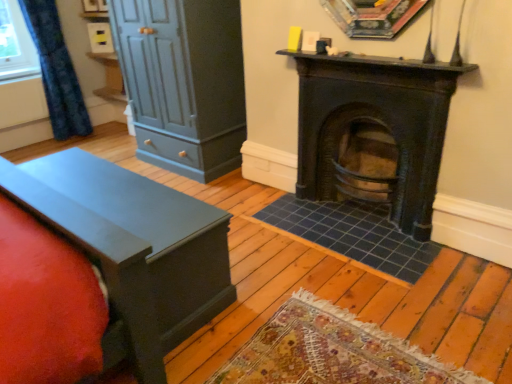
Question: Is matte dark gray dresser at left at the back of dark brown wood burning stove at center?

Choices:
 (A) yes
 (B) no

Answer: (B)

Question: Considering the relative sizes of dark brown wood burning stove at center and matte dark gray dresser at left in the image provided, is dark brown wood burning stove at center bigger than matte dark gray dresser at left?

Choices:
 (A) yes
 (B) no

Answer: (B)

Question: From the image's perspective, is dark brown wood burning stove at center above matte dark gray dresser at left?

Choices:
 (A) no
 (B) yes

Answer: (A)

Question: Is matte dark gray dresser at left a part of dark brown wood burning stove at center?

Choices:
 (A) yes
 (B) no

Answer: (B)

Question: Is the depth of dark brown wood burning stove at center greater than that of matte dark gray dresser at left?

Choices:
 (A) yes
 (B) no

Answer: (B)

Question: Based on their positions, is matte dark gray dresser at left located to the left or right of dark brown wood burning stove at center?

Choices:
 (A) right
 (B) left

Answer: (B)

Question: From the image's perspective, is matte dark gray dresser at left positioned above or below dark brown wood burning stove at center?

Choices:
 (A) above
 (B) below

Answer: (A)

Question: Does point (233, 44) appear closer or farther from the camera than point (404, 150)?

Choices:
 (A) closer
 (B) farther

Answer: (B)

Question: From a real-world perspective, relative to dark brown wood burning stove at center, is matte dark gray dresser at left vertically above or below?

Choices:
 (A) below
 (B) above

Answer: (B)

Question: Looking at their shapes, would you say matte black chest at left is wider or thinner than blue textured curtain at left?

Choices:
 (A) thin
 (B) wide

Answer: (B)

Question: Visually, is matte black chest at left positioned to the left or to the right of blue textured curtain at left?

Choices:
 (A) right
 (B) left

Answer: (A)

Question: Is matte black chest at left bigger or smaller than blue textured curtain at left?

Choices:
 (A) small
 (B) big

Answer: (B)

Question: From the image's perspective, relative to blue textured curtain at left, is matte black chest at left above or below?

Choices:
 (A) above
 (B) below

Answer: (B)

Question: From the image's perspective, is matte dark gray dresser at left positioned above or below matte black chest at left?

Choices:
 (A) below
 (B) above

Answer: (B)

Question: Is matte dark gray dresser at left situated inside matte black chest at left or outside?

Choices:
 (A) inside
 (B) outside

Answer: (B)